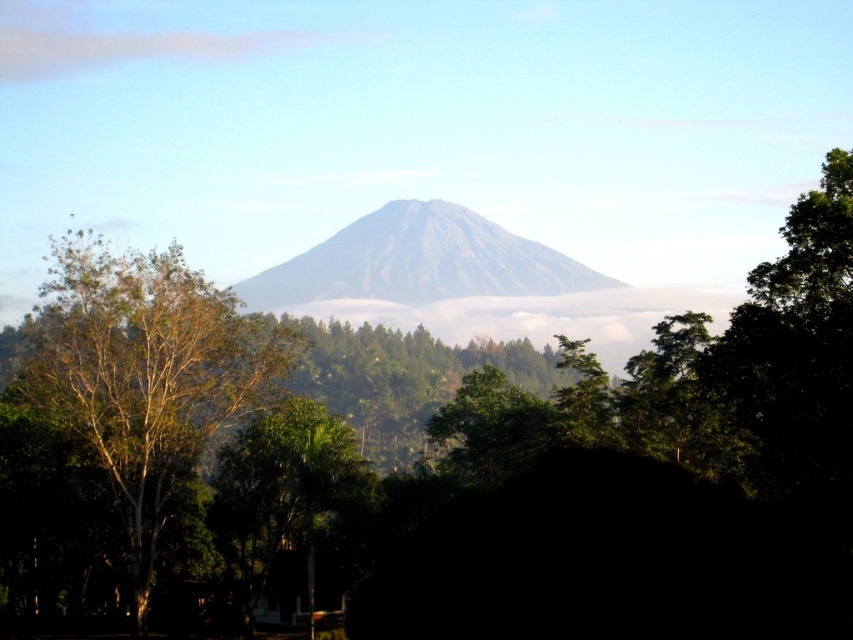
You are a hiker standing at the base of the gray matte mountain at center. You want to reach the summit. Given the coordinates provided in the description, can you determine the direction you should head to reach the peak?

The gray matte mountain at center is located at point (419, 262), so you should head towards the coordinates (419, 262) to reach the summit.

You are an environmental scientist assessing the health of the forest. You observe two green leafy trees in the scene. Which tree would likely have a larger canopy area, the green leafy tree at center or the green leafy tree at lower center?

The green leafy tree at center is larger in size than the green leafy tree at lower center, so it would likely have a larger canopy area.